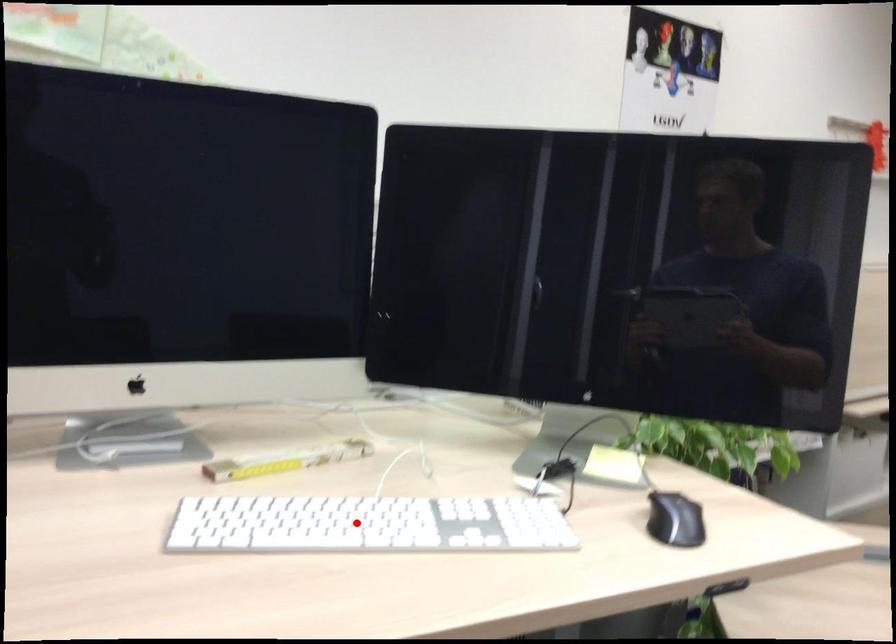
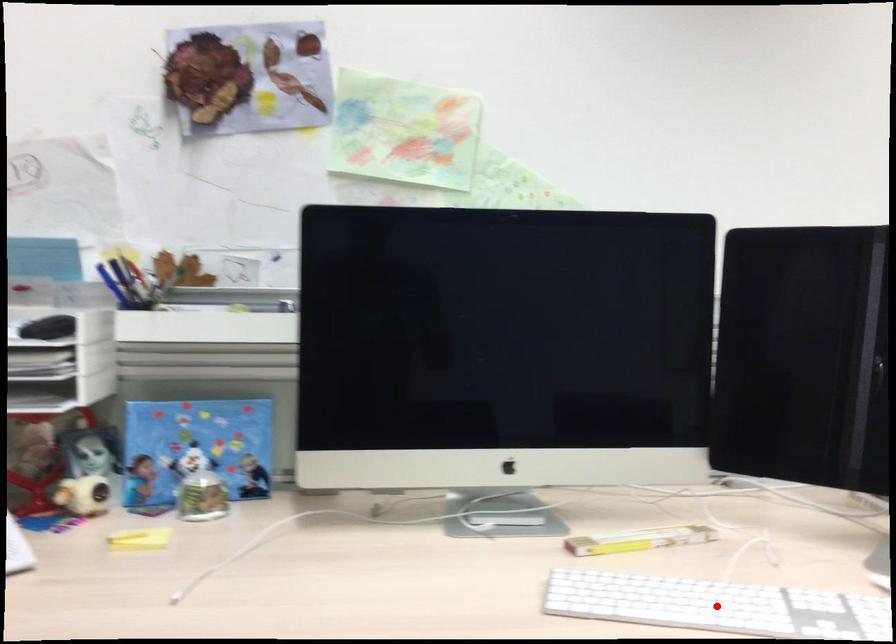
I am providing you with two images of the same scene from different viewpoints. A red point is marked on the first image and another point is marked on the second image. Do the highlighted points in image1 and image2 indicate the same real-world spot?

Yes